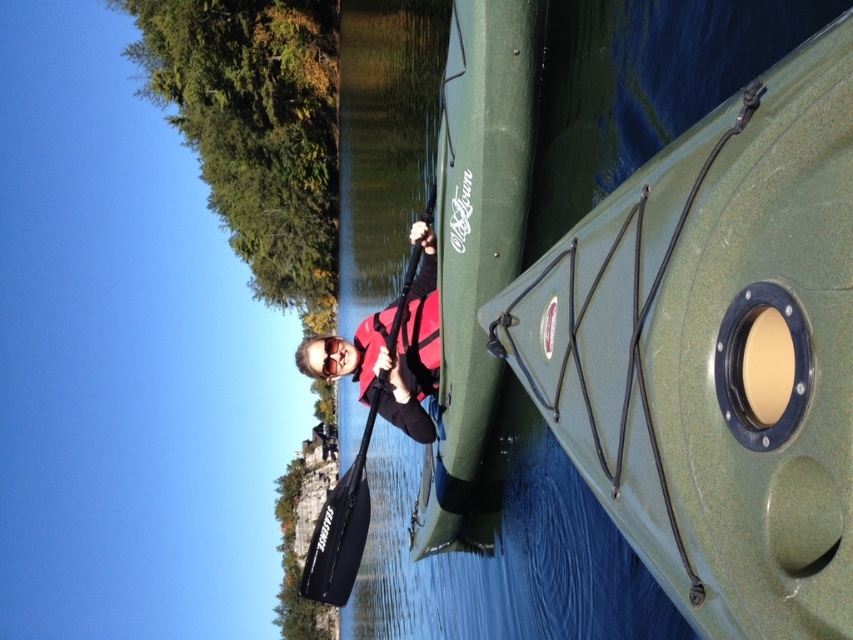
You are a safety inspector checking the kayaking equipment. The safety regulations state that the life jacket must be within 5 meters of the boat at all times for quick access. Based on the scene, is the orange life jacket at center compliant with the regulation when compared to the green rubber boat at center?

The green rubber boat at center is 10.28 meters away from the orange life jacket at center, which exceeds the 5 meter regulation. Therefore, the orange life jacket at center is not compliant with the safety requirement.

You are standing on the dock and see the green rubber boat at center. If you want to throw a lifebuoy to it, and the lifebuoy has a throwing range of 25 feet, will you be able to reach it?

The green rubber boat at center is 25.43 feet from camera. Since the lifebuoy has a throwing range of 25 feet, you will not be able to reach it as the distance is slightly beyond the range.